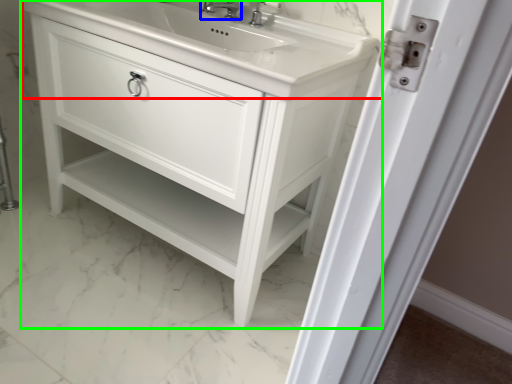
Question: Which is nearer to the counter top (highlighted by a red box)? tap (highlighted by a blue box) or bathroom cabinet (highlighted by a green box).

Choices:
 (A) tap
 (B) bathroom cabinet

Answer: (B)